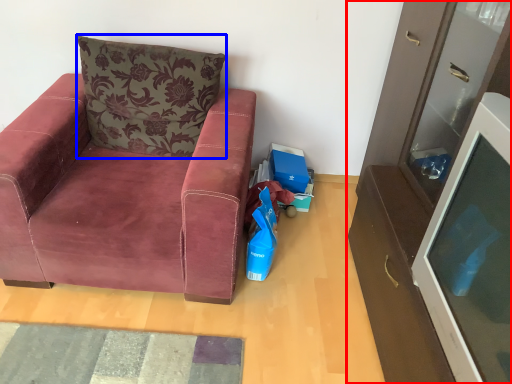
Question: Which of the following is the farthest to the observer, cabinetry (highlighted by a red box) or pillow (highlighted by a blue box)?

Choices:
 (A) cabinetry
 (B) pillow

Answer: (B)